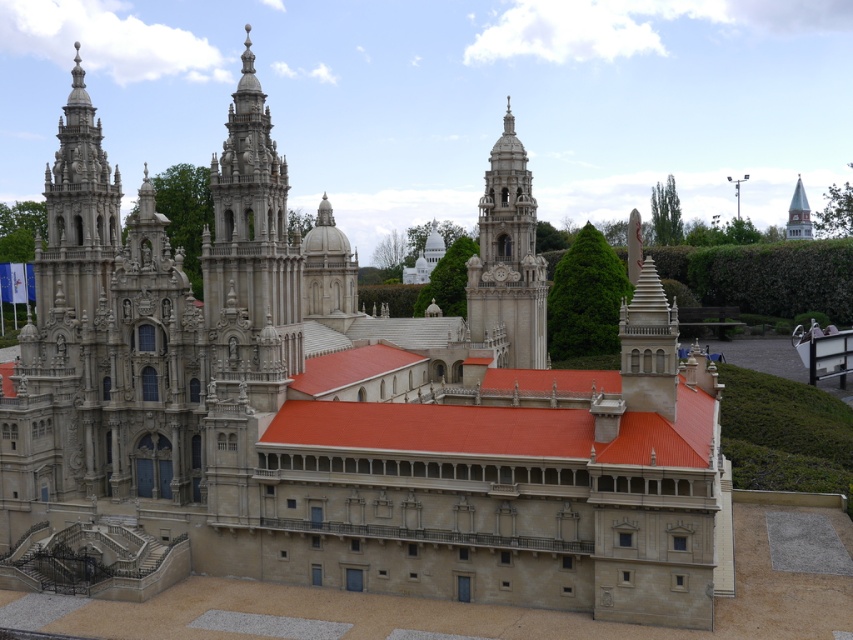
Question: Which point appears farthest from the camera in this image?

Choices:
 (A) (82, 220)
 (B) (801, 195)
 (C) (234, 154)
 (D) (497, 237)

Answer: (B)

Question: Is white stone clock tower at center bigger than smooth white spire at upper right?

Choices:
 (A) no
 (B) yes

Answer: (B)

Question: Can you confirm if white stone tower at left is positioned to the right of smooth white spire at upper right?

Choices:
 (A) yes
 (B) no

Answer: (B)

Question: From the image, what is the correct spatial relationship of smooth stone tower at center in relation to white stone tower at left?

Choices:
 (A) below
 (B) above

Answer: (A)

Question: Which point is farther to the camera?

Choices:
 (A) (804, 236)
 (B) (90, 289)

Answer: (A)

Question: Which of the following is the farthest from the observer?

Choices:
 (A) (253, 164)
 (B) (57, 148)
 (C) (798, 177)
 (D) (535, 300)

Answer: (C)